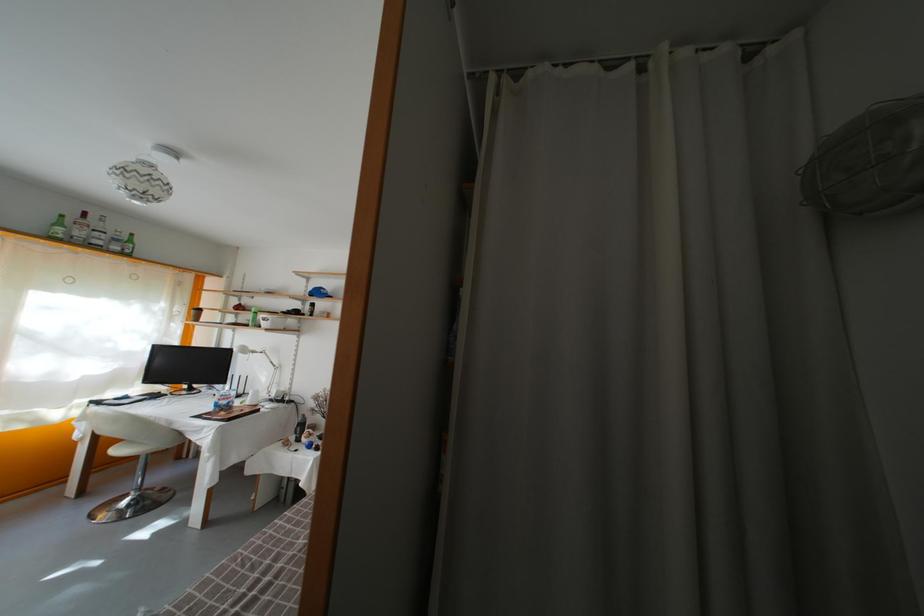
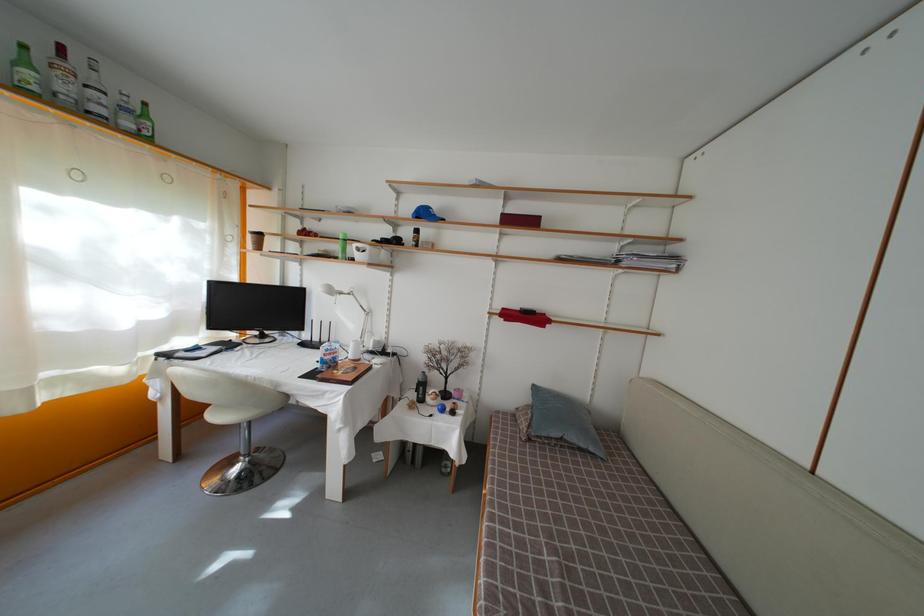
Locate, in the second image, the point that corresponds to point 67,230 in the first image.

(31, 69)